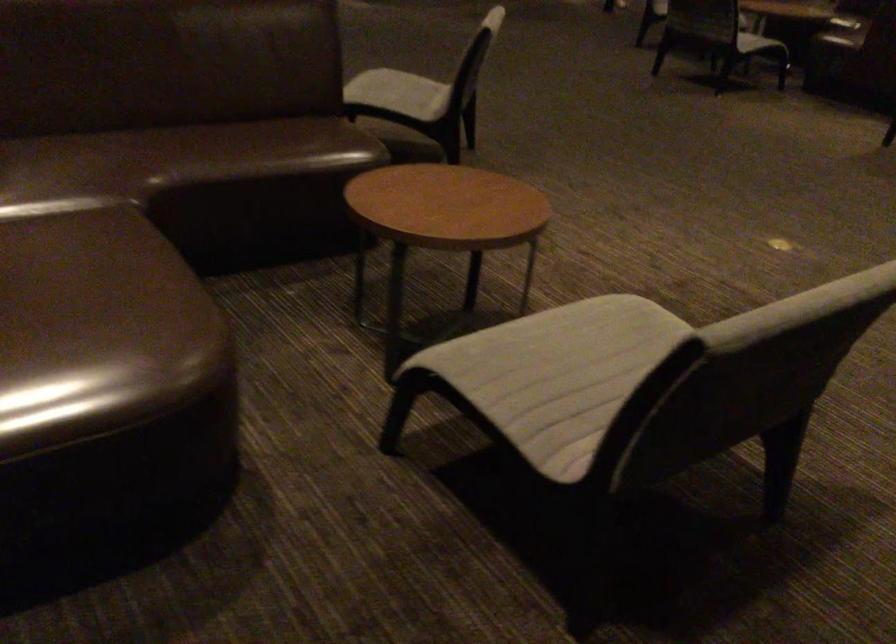
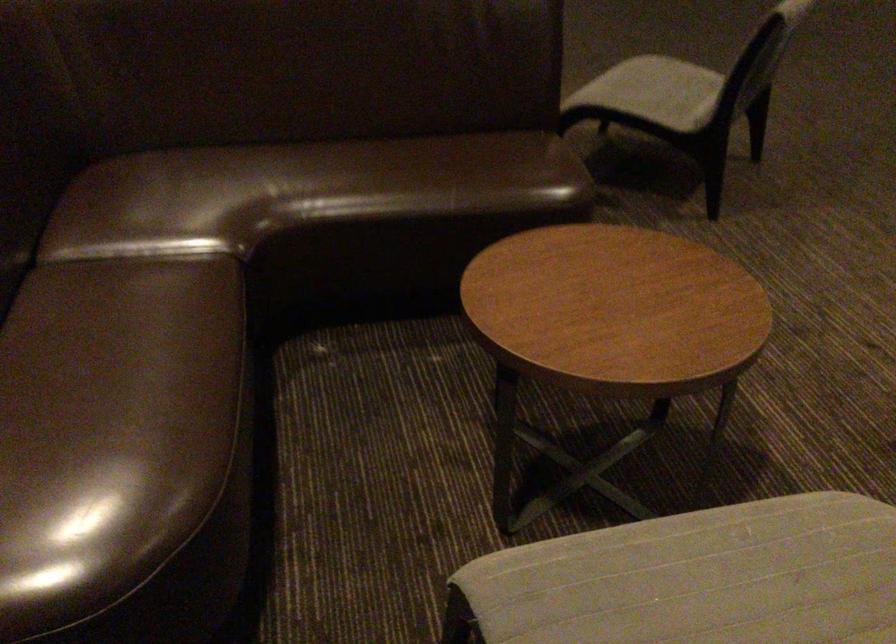
Find the pixel in the second image that matches pixel 407 93 in the first image.

(655, 91)